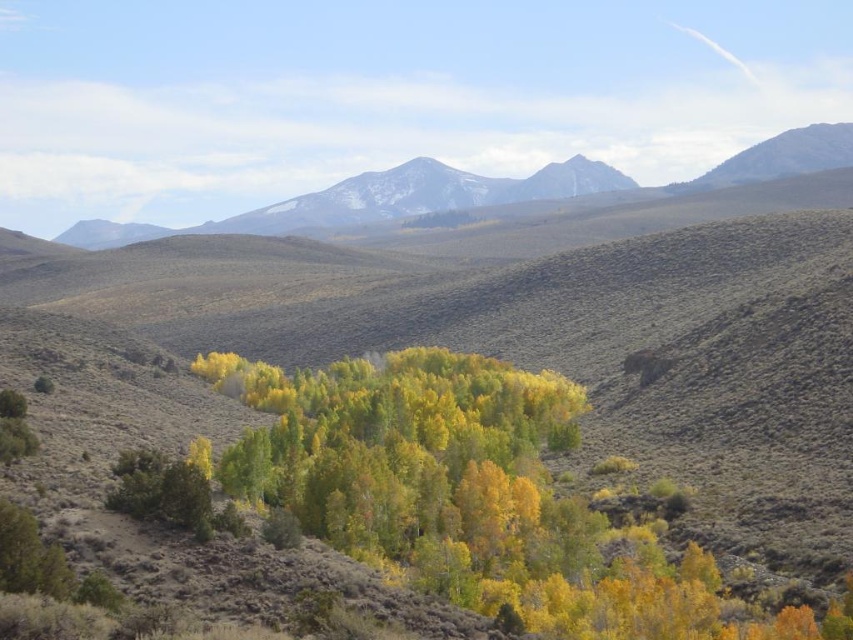
Can you confirm if yellow-green foliage at center is taller than snowy granite mountain range at upper center?

Incorrect, yellow-green foliage at center's height is not larger of snowy granite mountain range at upper center's.

Between point (720, 582) and point (575, 204), which one is positioned in front?

Point (720, 582) is in front.

Is point (247, 378) positioned before point (608, 168)?

Yes, it is in front of point (608, 168).

The image size is (853, 640). In order to click on yellow-green foliage at center in this screenshot , I will do [x=471, y=496].